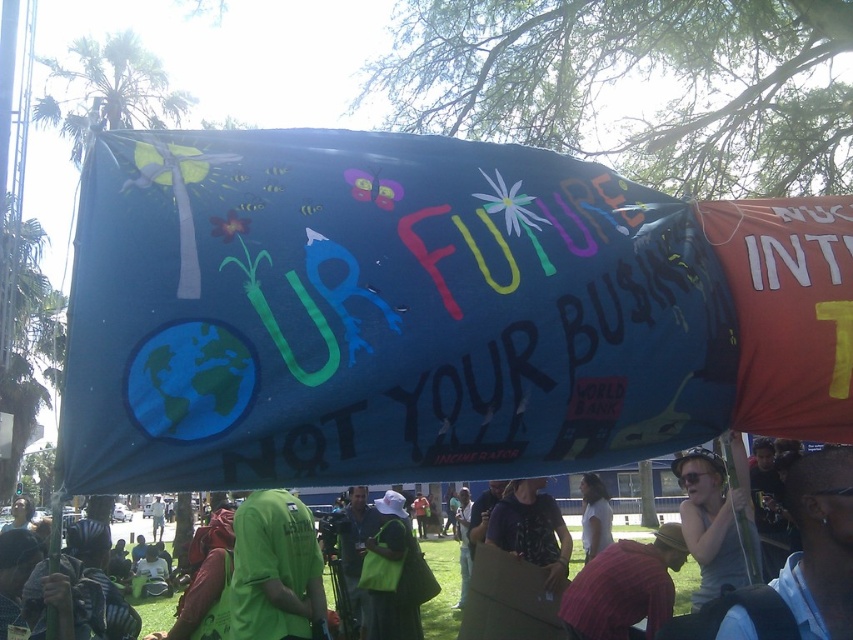
Does green fabric shirt at lower left have a lesser width compared to plaid shirt at lower center?

Correct, green fabric shirt at lower left's width is less than plaid shirt at lower center's.

Does green fabric shirt at lower left have a greater height compared to plaid shirt at lower center?

Correct, green fabric shirt at lower left is much taller as plaid shirt at lower center.

Identify the location of green fabric shirt at lower left. (276, 570).

Does green fabric shirt at lower left appear over white fabric at center?

Correct, green fabric shirt at lower left is located above white fabric at center.

Is green fabric shirt at lower left in front of white fabric at center?

Yes.

The width and height of the screenshot is (853, 640). In order to click on green fabric shirt at lower left in this screenshot , I will do `click(276, 570)`.

Is plaid shirt at lower center to the right of white fabric at center from the viewer's perspective?

No, plaid shirt at lower center is not to the right of white fabric at center.

Is plaid shirt at lower center shorter than white fabric at center?

Yes.

Between point (614, 637) and point (596, 515), which one is positioned in front?

Positioned in front is point (614, 637).

At what (x,y) coordinates should I click in order to perform the action: click on plaid shirt at lower center. Please return your answer as a coordinate pair (x, y). This screenshot has width=853, height=640. Looking at the image, I should click on (624, 588).